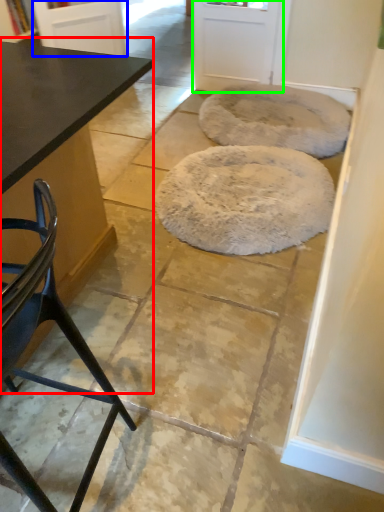
Question: Which object is positioned closest to table (highlighted by a red box)? Select from screen door (highlighted by a blue box) and screen door (highlighted by a green box).

Choices:
 (A) screen door
 (B) screen door

Answer: (A)